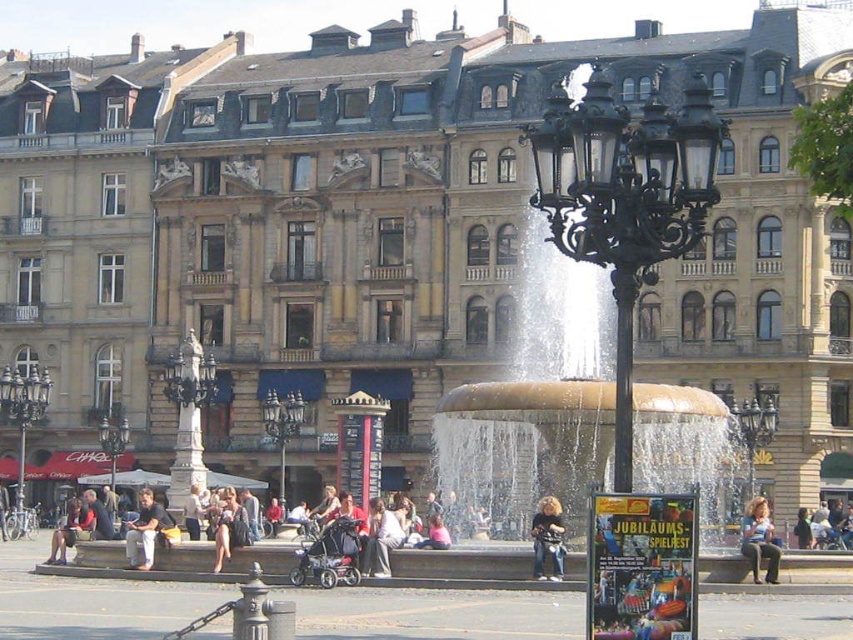
Question: Which of these objects is positioned closest to the matte black jacket at center?

Choices:
 (A) black wrought iron streetlight at center
 (B) light brown leather jacket at lower right
 (C) dark brown leather jacket at center
 (D) polished bronze lamp post at center

Answer: (C)

Question: Can you confirm if polished bronze streetlamp at left is thinner than polished bronze lamp post at center?

Choices:
 (A) no
 (B) yes

Answer: (A)

Question: From the image, what is the correct spatial relationship of light brown leather jacket at lower right in relation to dark brown leather jacket at center?

Choices:
 (A) left
 (B) right

Answer: (B)

Question: Can you confirm if gold polished water at center is thinner than light brown leather jacket at center?

Choices:
 (A) yes
 (B) no

Answer: (B)

Question: Which point appears closest to the camera in this image?

Choices:
 (A) (561, 525)
 (B) (21, 406)

Answer: (A)

Question: Which of the following is the farthest from the observer?

Choices:
 (A) (630, 234)
 (B) (283, 422)
 (C) (759, 561)

Answer: (B)